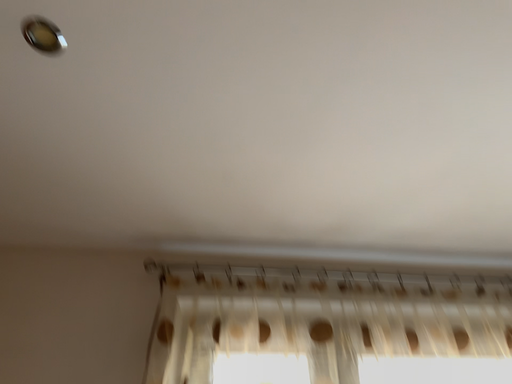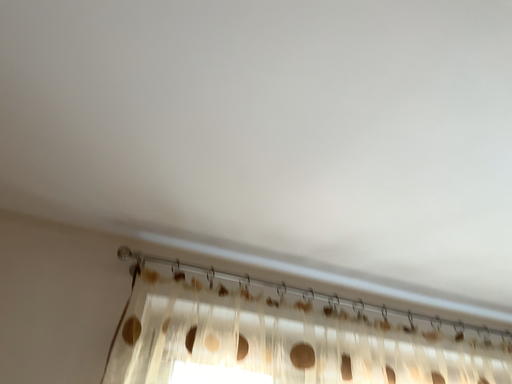
Question: How did the camera likely rotate when shooting the video?

Choices:
 (A) rotated left
 (B) rotated right

Answer: (B)